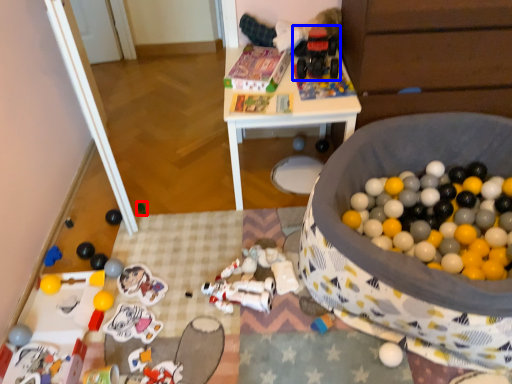
Question: Which object is closer to the camera taking this photo, toy (highlighted by a red box) or toy (highlighted by a blue box)?

Choices:
 (A) toy
 (B) toy

Answer: (B)